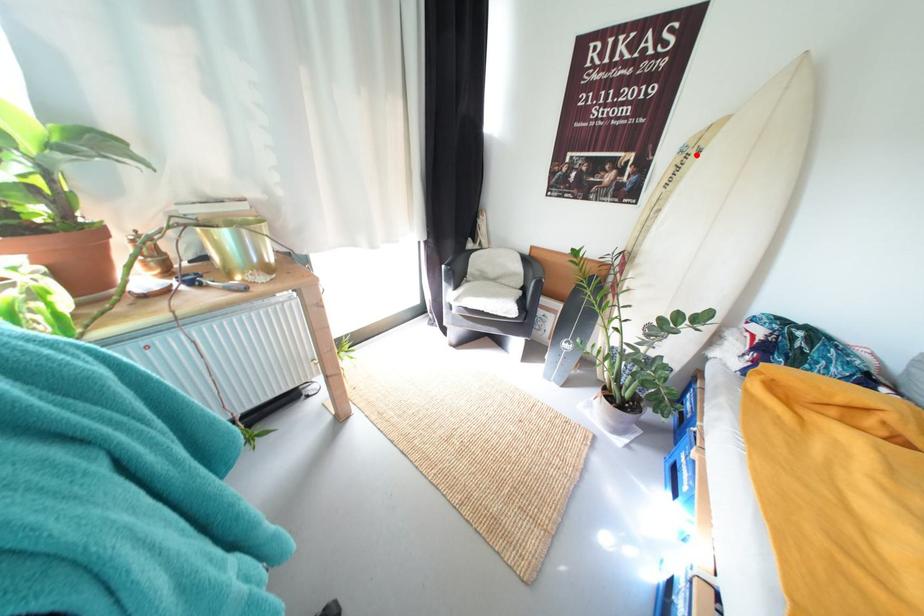
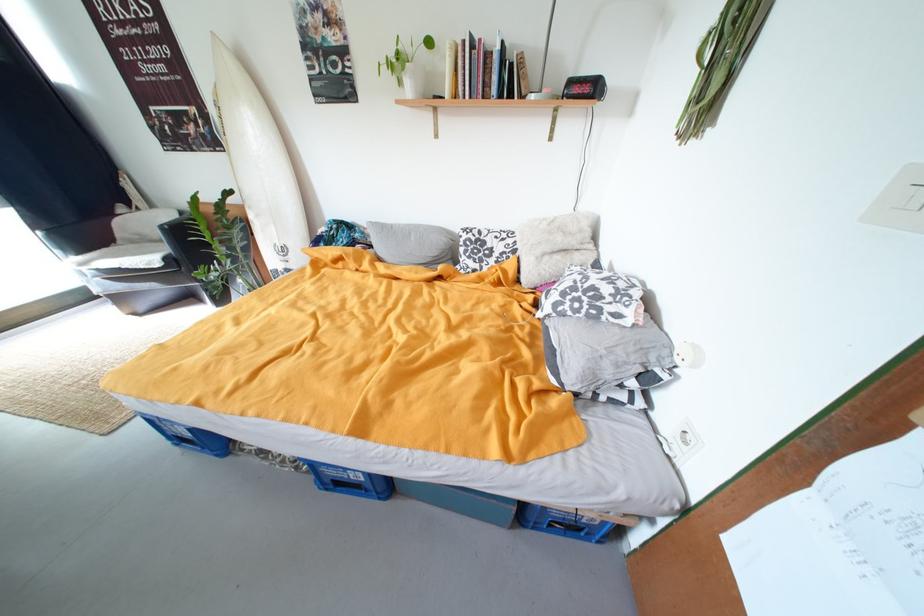
In the second image, find the point that corresponds to the highlighted location in the first image.

(225, 108)